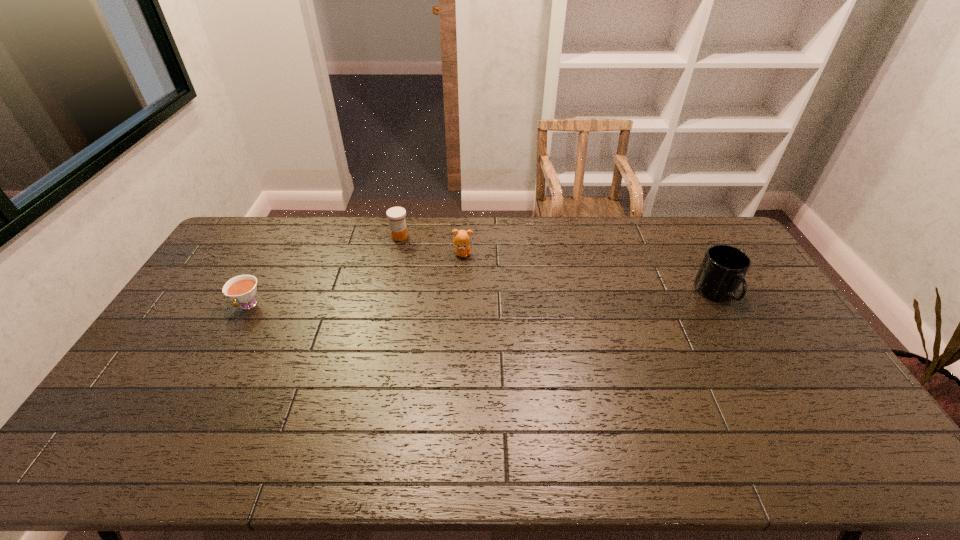
Where is `free space on the desktop that is between the teacup and the rightmost object and is positioned on the label of the third object from right to left`? This screenshot has height=540, width=960. free space on the desktop that is between the teacup and the rightmost object and is positioned on the label of the third object from right to left is located at coordinates (460, 300).

Where is `vacant space on the desktop that is between the shortest object and the rightmost object and is positioned on the face of the teddy bear`? The height and width of the screenshot is (540, 960). vacant space on the desktop that is between the shortest object and the rightmost object and is positioned on the face of the teddy bear is located at coordinates [x=546, y=298].